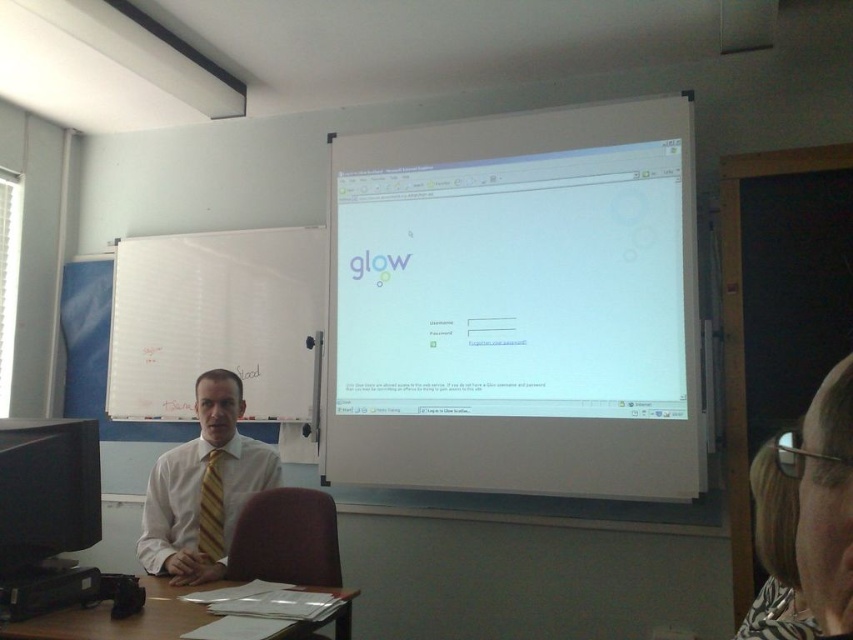
Question: Does zebra print blouse at lower right appear over black glossy monitor at left?

Choices:
 (A) no
 (B) yes

Answer: (B)

Question: Considering the relative positions of white glossy projection screen at upper center and white shirt at center in the image provided, where is white glossy projection screen at upper center located with respect to white shirt at center?

Choices:
 (A) left
 (B) right

Answer: (B)

Question: Based on their relative distances, which object is farther from the yellow striped tie at center?

Choices:
 (A) zebra print blouse at lower right
 (B) brown wooden table at lower left
 (C) white shirt at center
 (D) white glossy projection screen at upper center

Answer: (A)

Question: Does white shirt at center appear over brown wooden table at lower left?

Choices:
 (A) yes
 (B) no

Answer: (A)

Question: Which point is farther to the camera?

Choices:
 (A) (804, 452)
 (B) (49, 483)
 (C) (219, 502)

Answer: (C)

Question: Which point is farther to the camera?

Choices:
 (A) yellow striped tie at center
 (B) white shirt at center
 (C) black glossy monitor at left

Answer: (A)